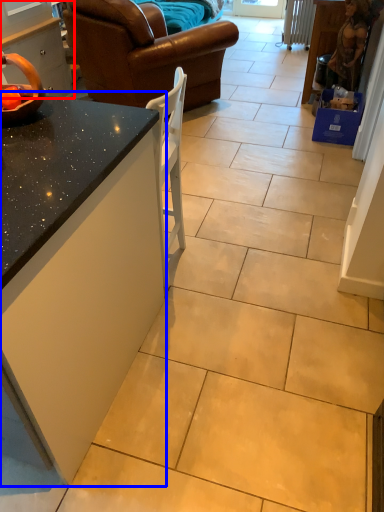
Question: Which of the following is the closest to the observer, cabinetry (highlighted by a red box) or countertop (highlighted by a blue box)?

Choices:
 (A) cabinetry
 (B) countertop

Answer: (B)